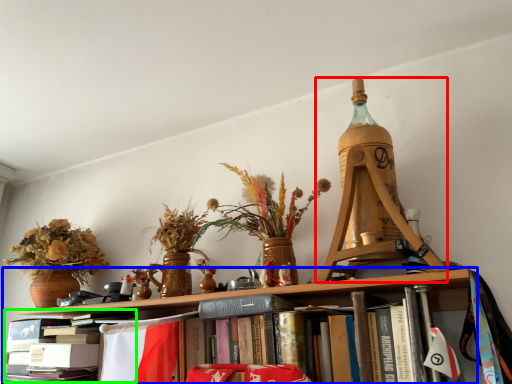
Question: Based on their relative distances, which object is farther from Eiffel tower (highlighted by a red box)? Choose from shelf (highlighted by a blue box) and book (highlighted by a green box).

Choices:
 (A) shelf
 (B) book

Answer: (B)